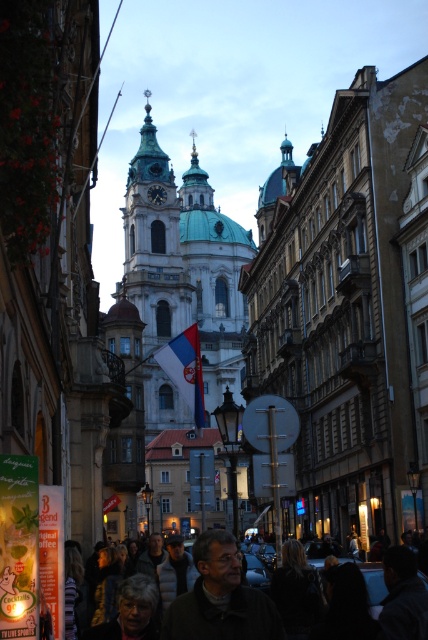
Between white stone tower at center and dark green sweater at center, which one has more height?

With more height is white stone tower at center.

Identify the location of white stone tower at center. (181, 275).

Locate an element on the screen. This screenshot has width=428, height=640. white stone tower at center is located at coordinates (181, 275).

Can you confirm if dark gray wool coat at center is thinner than white fabric flag at center?

No.

Which of these two, dark gray wool coat at center or white fabric flag at center, stands shorter?

With less height is dark gray wool coat at center.

Does point (287, 564) lie in front of point (189, 356)?

Yes, point (287, 564) is in front of point (189, 356).

The image size is (428, 640). What are the coordinates of `dark gray wool coat at center` in the screenshot? It's located at (371, 584).

This screenshot has height=640, width=428. Describe the element at coordinates (220, 598) in the screenshot. I see `dark green sweater at center` at that location.

Identify the location of dark green sweater at center. (220, 598).

Who is more forward, [213,560] or [184,397]?

Point [213,560] is in front.

Image resolution: width=428 pixels, height=640 pixels. In order to click on dark green sweater at center in this screenshot , I will do `click(220, 598)`.